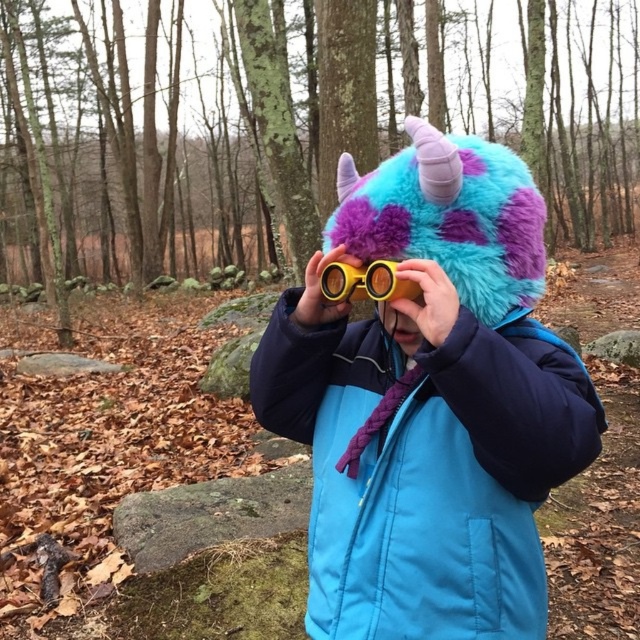
Which is more to the right, blue quilted jacket at center or yellow plastic goggles at center?

From the viewer's perspective, blue quilted jacket at center appears more on the right side.

Between point (316, 582) and point (388, 272), which one is positioned behind?

The point (316, 582) is more distant.

Who is more forward, (x=525, y=445) or (x=330, y=296)?

A: Point (x=525, y=445) is in front.

Where is `blue quilted jacket at center`? Image resolution: width=640 pixels, height=640 pixels. blue quilted jacket at center is located at coordinates (428, 468).